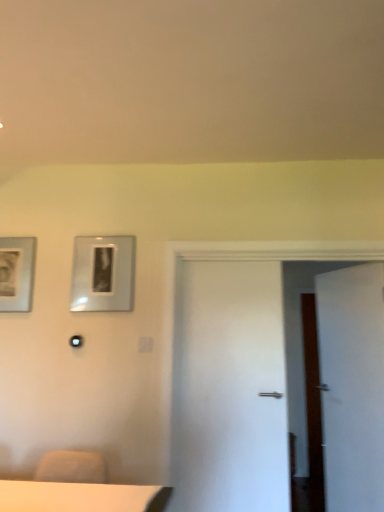
Question: Is metallic silver picture frame at upper left, the first picture frame from the right, wider or thinner than white matte door at right?

Choices:
 (A) wide
 (B) thin

Answer: (B)

Question: From the image's perspective, is metallic silver picture frame at upper left, the first picture frame from the right, positioned above or below white matte door at right?

Choices:
 (A) below
 (B) above

Answer: (B)

Question: Which of these objects is positioned farthest from the metallic silver picture frame at upper left, the second picture frame positioned from the left?

Choices:
 (A) matte silver picture frame at left, placed as the 1th picture frame when sorted from left to right
 (B) white matte door at right

Answer: (B)

Question: Which is nearer to the metallic silver picture frame at upper left, the first picture frame from the right?

Choices:
 (A) white matte door at right
 (B) matte silver picture frame at left, placed as the 1th picture frame when sorted from left to right

Answer: (B)